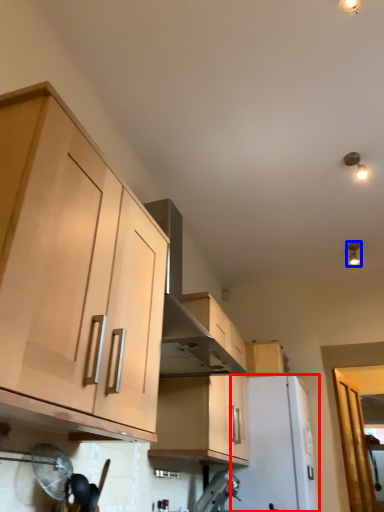
Question: Which object is further to the camera taking this photo, appliance (highlighted by a red box) or light fixture (highlighted by a blue box)?

Choices:
 (A) appliance
 (B) light fixture

Answer: (B)